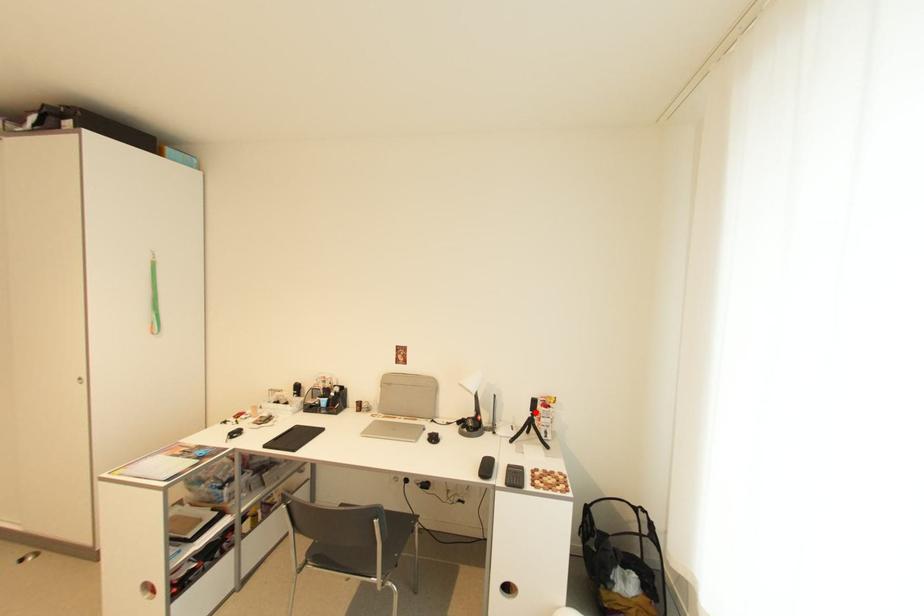
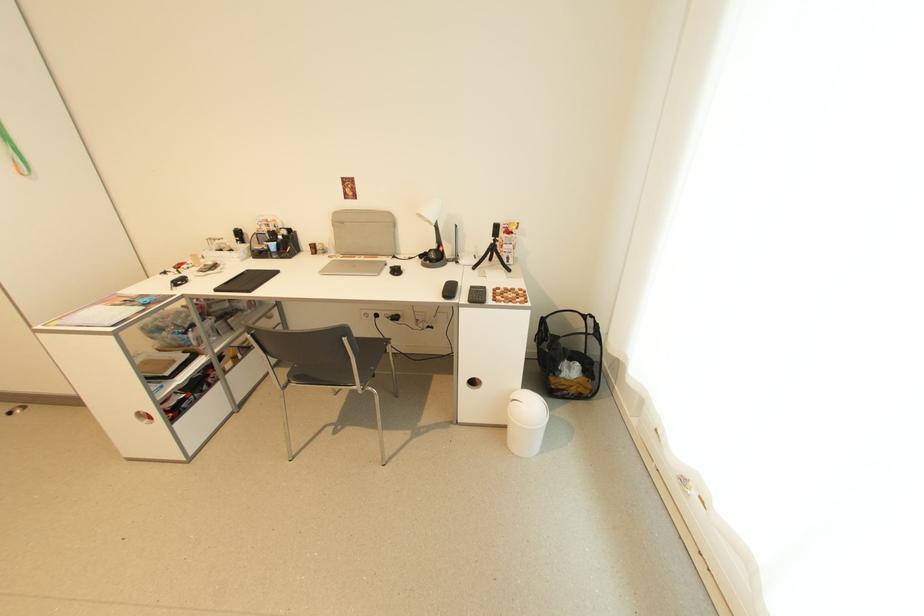
Question: I am providing you with two images of the same scene from different viewpoints. In image1, a red point is highlighted. Considering the same 3D point in image2, which of the following is correct?

Choices:
 (A) It is closer
 (B) It is farther

Answer: (A)